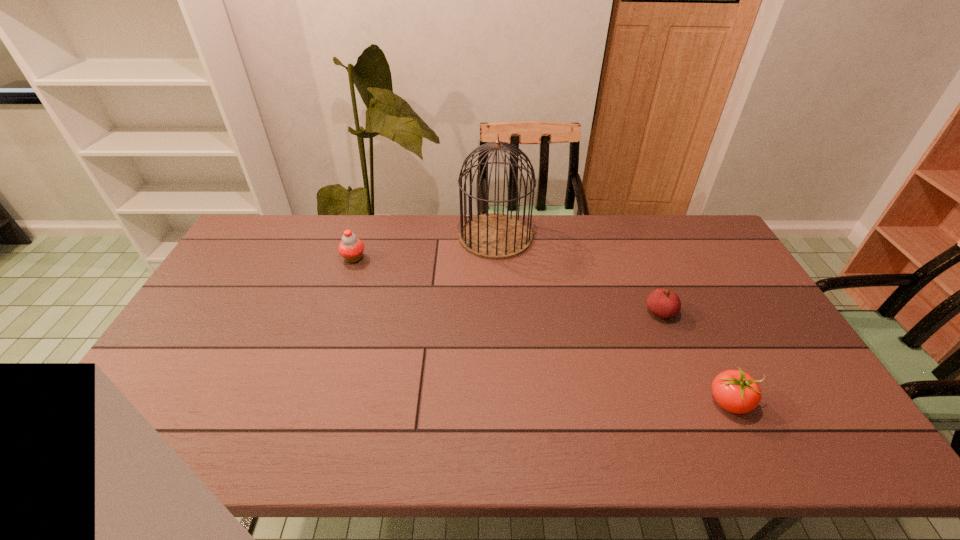
The image size is (960, 540). Identify the location of blank area in the image that satisfies the following two spatial constraints: 1. at the door of the nearer tomato; 2. on the left side of the second object from left to right. (503, 402).

Locate an element on the screen. This screenshot has height=540, width=960. free point that satisfies the following two spatial constraints: 1. at the door of the tallest object; 2. on the left side of the nearer tomato is located at coordinates (503, 402).

Identify the location of free location that satisfies the following two spatial constraints: 1. at the door of the third farthest object; 2. on the right side of the birdcage. The height and width of the screenshot is (540, 960). (499, 313).

Locate an element on the screen. The height and width of the screenshot is (540, 960). free location that satisfies the following two spatial constraints: 1. at the door of the farther tomato; 2. on the right side of the birdcage is located at coordinates (499, 313).